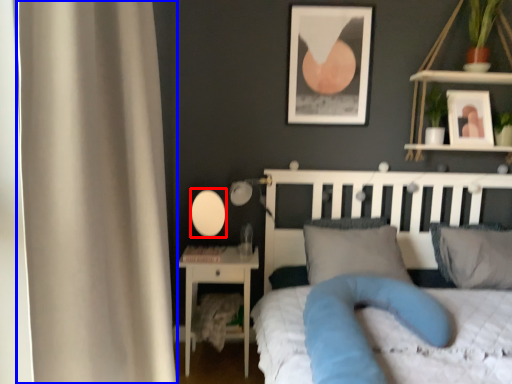
Question: Which point is further to the camera, oval (highlighted by a red box) or curtain (highlighted by a blue box)?

Choices:
 (A) oval
 (B) curtain

Answer: (A)